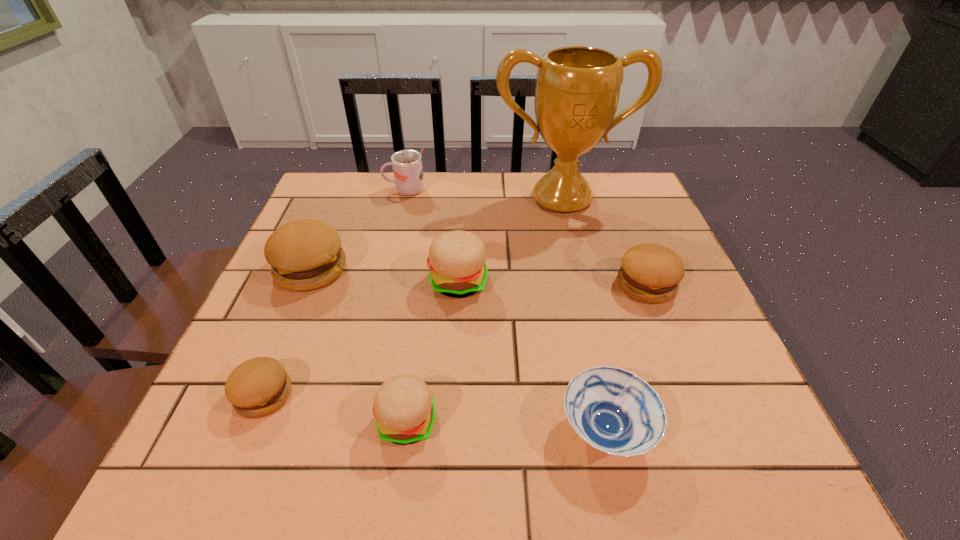
Identify the location of award that is at the far edge. This screenshot has height=540, width=960. (577, 91).

This screenshot has width=960, height=540. What are the coordinates of `cup that is at the far edge` in the screenshot? It's located at (407, 164).

Locate an element on the screen. The height and width of the screenshot is (540, 960). hamburger present at the near edge is located at coordinates (404, 409).

Where is `soup bowl that is at the near edge`? soup bowl that is at the near edge is located at coordinates click(615, 411).

Where is `award present at the right edge`? Image resolution: width=960 pixels, height=540 pixels. award present at the right edge is located at coordinates (577, 91).

What are the coordinates of `hamburger that is positioned at the right edge` in the screenshot? It's located at (650, 273).

I want to click on object at the far right corner, so click(x=577, y=91).

In the image, there is a desktop. At what (x,y) coordinates should I click in order to perform the action: click on vacant space at the far edge. Please return your answer as a coordinate pair (x, y). This screenshot has height=540, width=960. Looking at the image, I should click on (438, 184).

Identify the location of vacant space at the near edge. (666, 466).

Locate an element on the screen. The height and width of the screenshot is (540, 960). vacant space at the left edge of the desktop is located at coordinates (x=225, y=375).